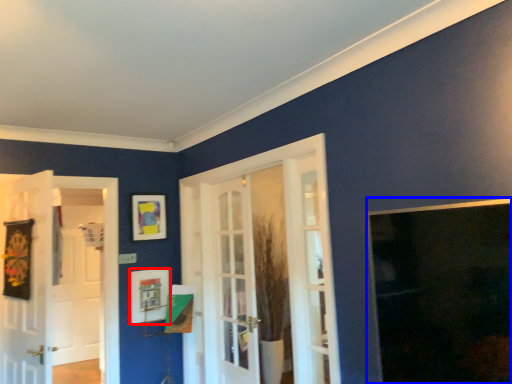
Question: Among these objects, which one is nearest to the camera, picture frame (highlighted by a red box) or window (highlighted by a blue box)?

Choices:
 (A) picture frame
 (B) window

Answer: (B)